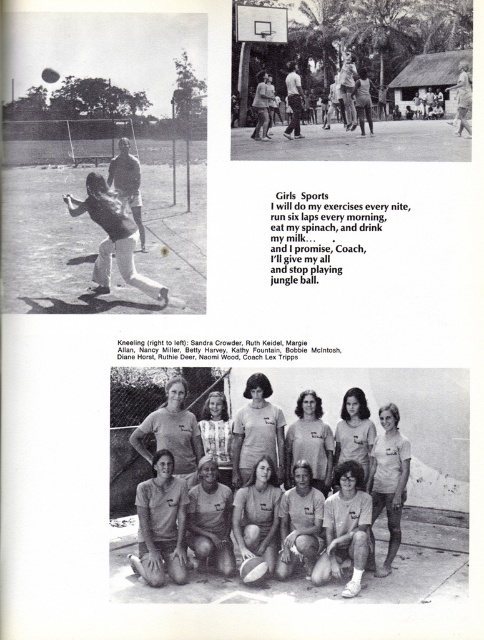
You are a photographer trying to determine the best angle to capture both the light brown hair at center and the light brown leather jacket at center in the same frame. Based on their heights, which object should you position closer to the camera to ensure both are fully visible?

The light brown hair at center is not as tall as the light brown leather jacket at center, so you should position the light brown leather jacket at center closer to the camera to ensure both are fully visible.

Based on the provided yearbook page layout with the top left tennis player and top right basketball group, where is the point located at coordinates (x=347, y=90)?

The point at coordinates (x=347, y=90) corresponds to the smooth skin man at center.

You are a photographer standing in front of the yearbook page. You want to take a closeup shot of the smooth skin man at center. Considering the distance, is it possible to do so without moving closer?

The smooth skin man at center is 21.48 meters from viewer, so it is possible to take a closeup shot without moving closer by using a zoom lens.